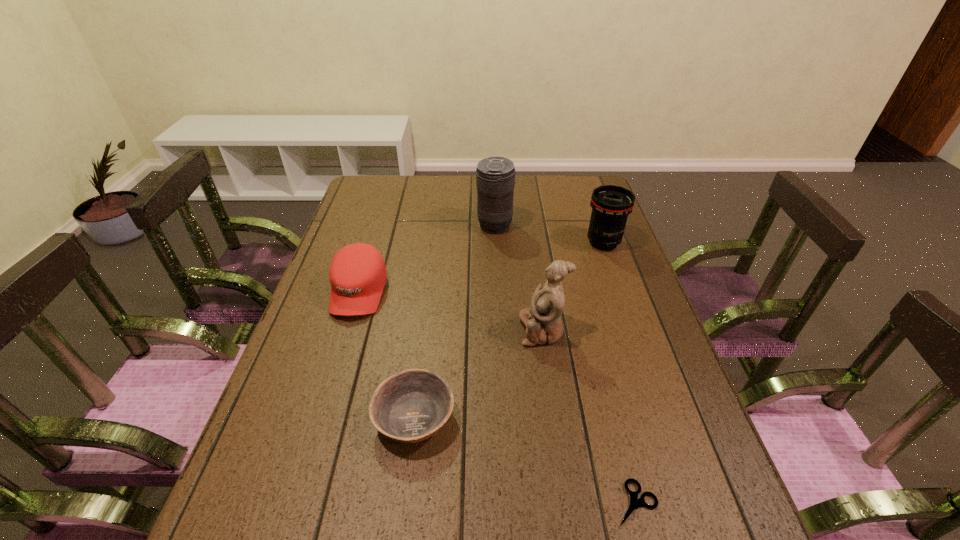
This screenshot has height=540, width=960. In order to click on free location that satisfies the following two spatial constraints: 1. on the front side of the shears; 2. on the right side of the second shortest object in this screenshot , I will do `click(404, 503)`.

Image resolution: width=960 pixels, height=540 pixels. What are the coordinates of `free space that satisfies the following two spatial constraints: 1. on the back side of the rightmost object; 2. on the right side of the shears` in the screenshot? It's located at (569, 242).

Find the location of a particular element. vacant position in the image that satisfies the following two spatial constraints: 1. on the side of the shears where the control switches are located; 2. on the right side of the left telephoto lens is located at coordinates (506, 503).

Locate an element on the screen. vacant position in the image that satisfies the following two spatial constraints: 1. on the back side of the right telephoto lens; 2. on the right side of the second nearest object is located at coordinates (437, 242).

The height and width of the screenshot is (540, 960). I want to click on vacant space that satisfies the following two spatial constraints: 1. on the side of the left telephoto lens where the control switches are located; 2. on the front-facing side of the third shortest object, so click(497, 292).